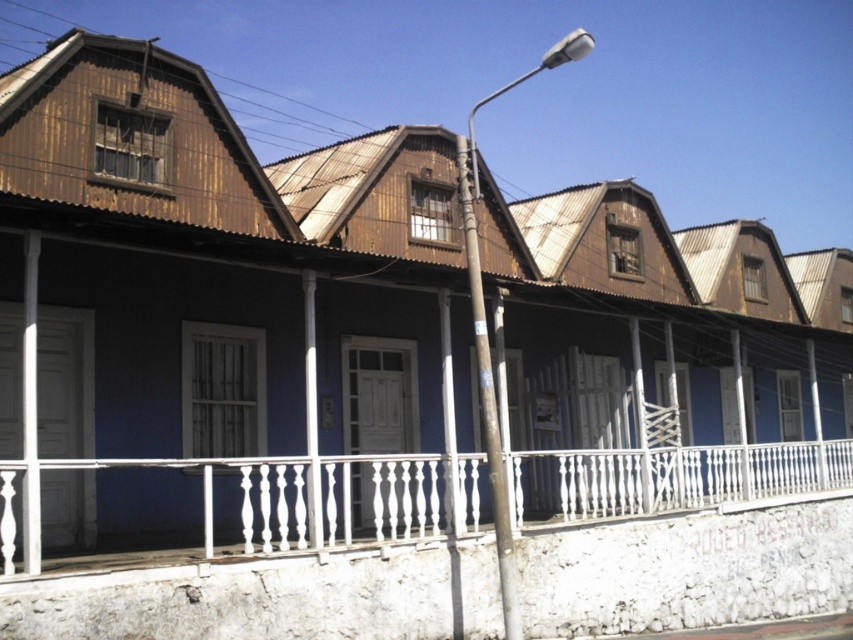
You are standing in front of the row of traditional houses. There are two points marked on the image, one at point coordinates point (671, 449) and another at point coordinates point (491, 476). Which point is closer to you?

Point (491, 476) is closer to you because it is less further to the camera than point (671, 449).

You are a delivery person trying to deliver a package to the house. The package requires a space of at least 4 meters between the white painted wood balustrade at center and the smooth gray pole at center to maneuver the delivery cart. Can you fit through the space between them?

The white painted wood balustrade at center and the smooth gray pole at center are 4.31 meters apart, so yes, the delivery cart can fit through the space between them since the distance is more than the required 4 meters.

You are standing in front of the row of traditional houses and want to know what the point at coordinates (299, 499) represents. What is it?

The point at coordinates (299, 499) corresponds to the white painted wood balustrade at center.